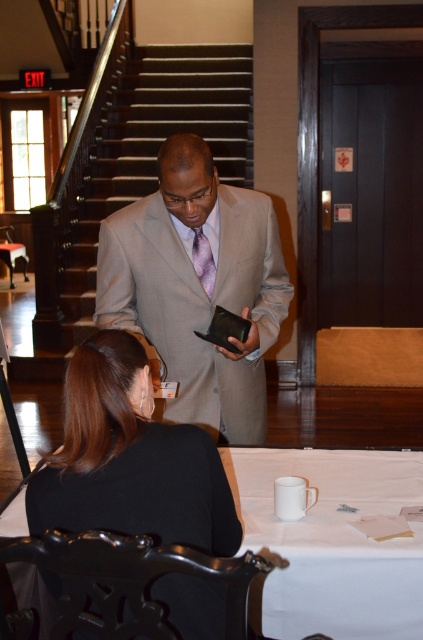
From the picture: You are organizing a small event and need to place a decorative vase between the black fabric jacket at lower left and the white matte table at center. Which object should the vase be placed closer to if it needs to be positioned at the same height level as the taller object?

The vase should be placed closer to the black fabric jacket at lower left because it is taller than the white matte table at center.

You are organizing a small event and need to place a decorative centerpiece on the table. Considering the objects present, will the black fabric jacket at lower left fit on the white matte table at center without overlapping the edges?

The black fabric jacket at lower left has a smaller size compared to white matte table at center, so it will fit without overlapping the edges.